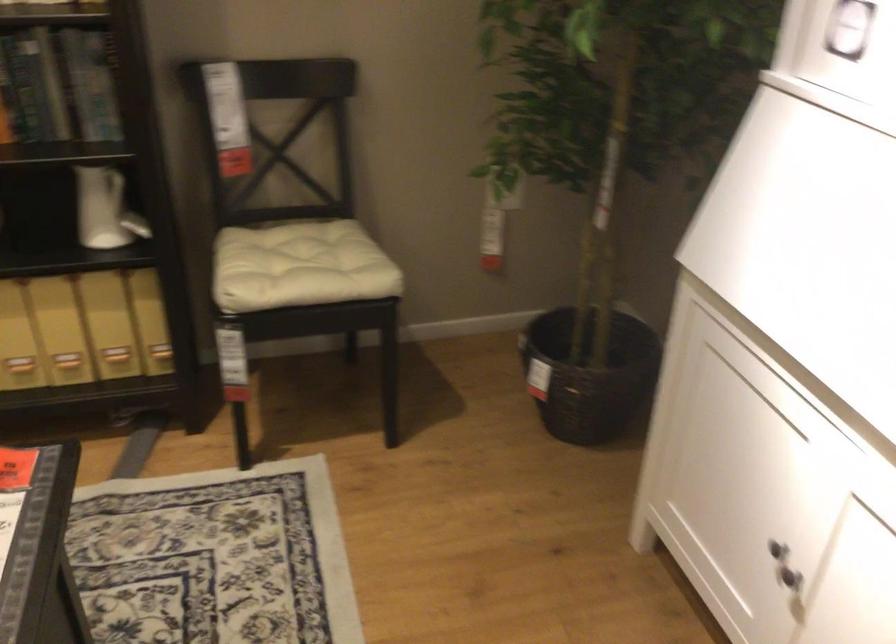
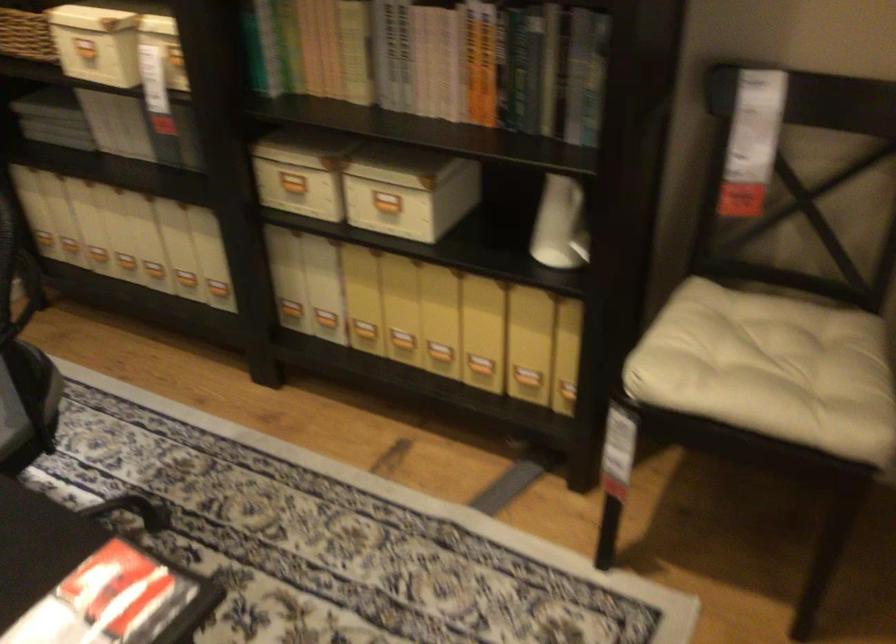
The point at (305, 269) is marked in the first image. Where is the corresponding point in the second image?

(776, 366)